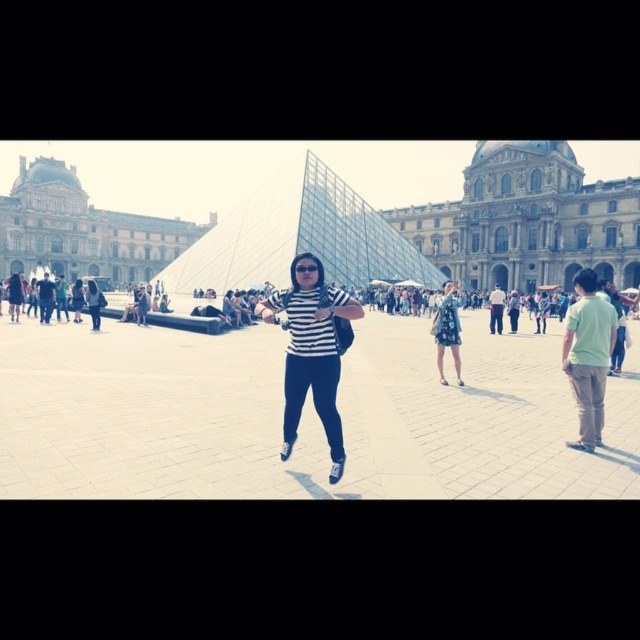
You are standing at the Louvre Museum and see two points marked on the ground near the glass pyramid. The first point is at coordinates point (525, 282) and the second is at point (440, 368). Which point is closer to you?

Point (525, 282) is closer to you because it is further to the viewer than point (440, 368).

You are standing in the courtyard of the Louvre Museum and see both the stone facade building at center and the blue floral dress at center. Which object is closer to you?

The blue floral dress at center is closer to you because the stone facade building at center is positioned over it, indicating it is further away.

You are standing in the courtyard of the Louvre Museum and see the stone facade building at center and the striped fabric at center. Which object is closer to you?

The stone facade building at center is closer to you because it is positioned further to the viewer than the striped fabric at center.